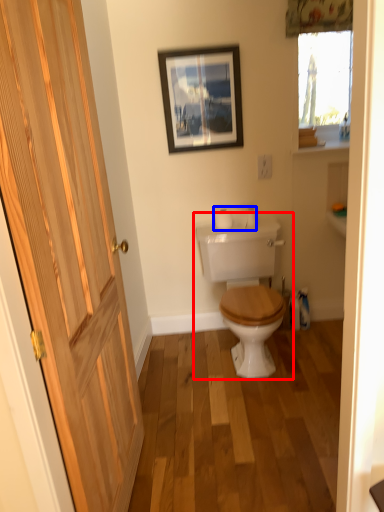
Question: Which of the following is the farthest to the observer, toilet (highlighted by a red box) or toilet paper (highlighted by a blue box)?

Choices:
 (A) toilet
 (B) toilet paper

Answer: (B)